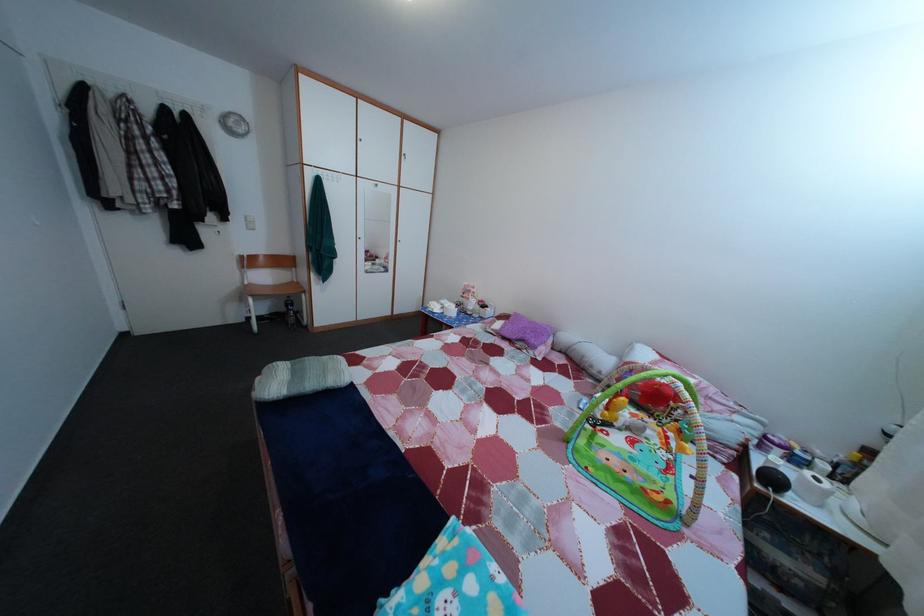
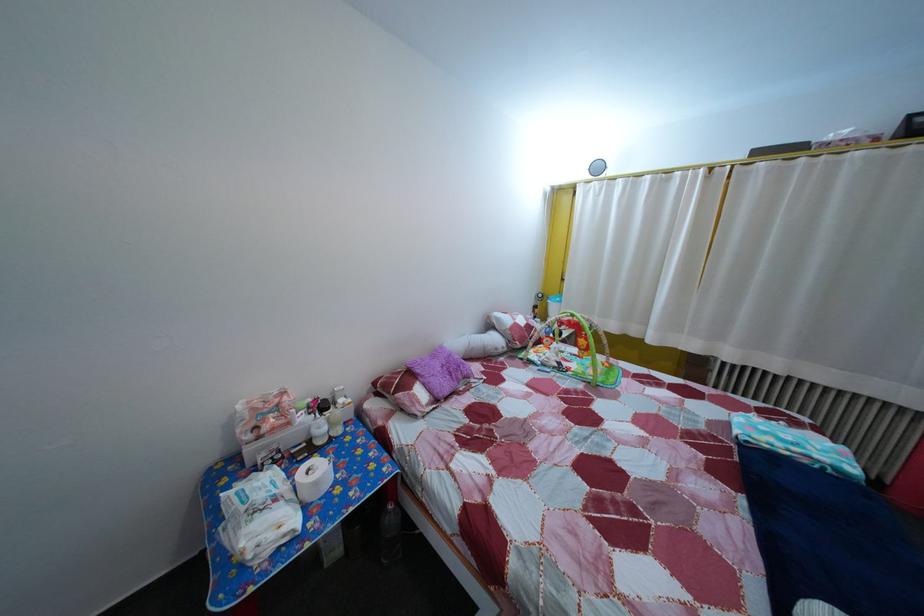
Find the pixel in the second image that matches the point at 478,307 in the first image.

(298, 432)